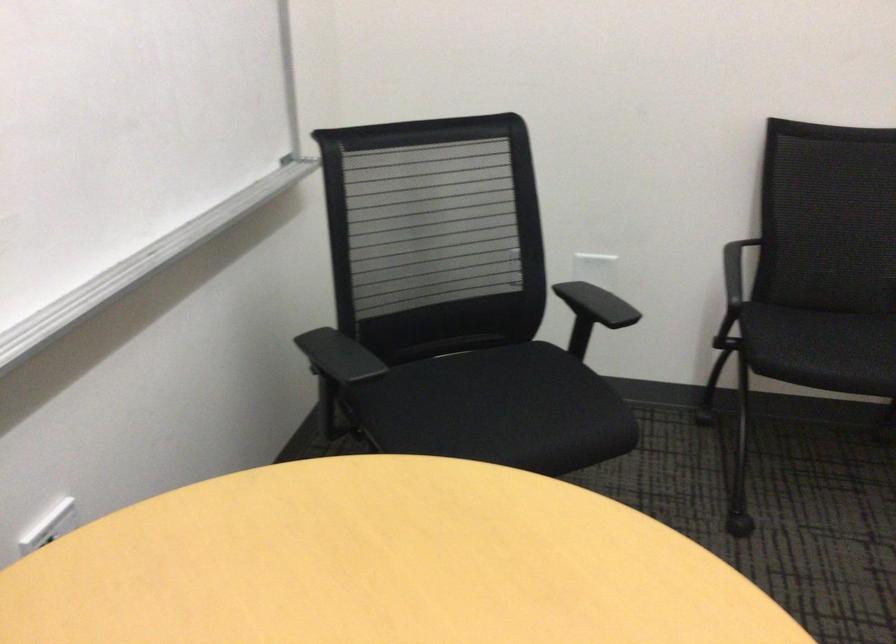
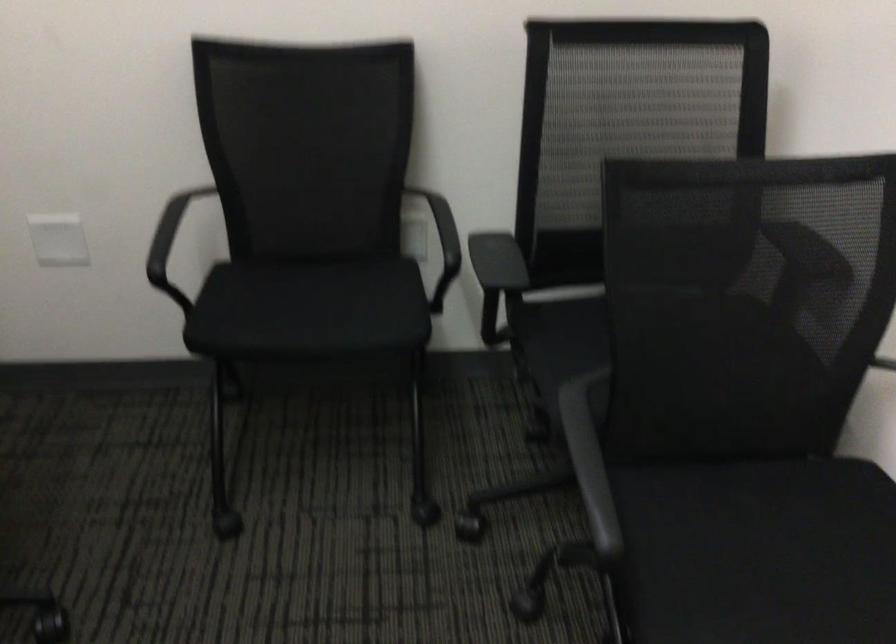
Question: Based on the continuous images, in which direction is the camera rotating? Reply with the corresponding letter.

Choices:
 (A) Left
 (B) Right
 (C) Up
 (D) Down

Answer: (B)